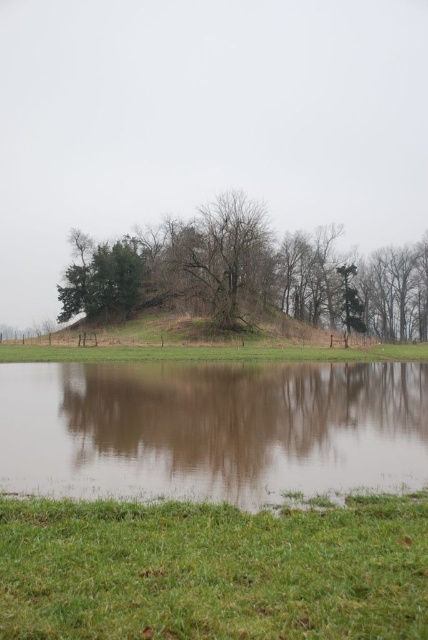
Who is positioned more to the right, green leafy tree at center or green grassy field at center?

green leafy tree at center

Who is higher up, green leafy tree at center or green grassy field at center?

green leafy tree at center is higher up.

Find the location of a particular element. green leafy tree at center is located at coordinates (247, 275).

Is green leafy tree at center smaller than green matte tree at upper left?

No, green leafy tree at center is not smaller than green matte tree at upper left.

Is green leafy tree at center thinner than green matte tree at upper left?

No.

Locate an element on the screen. The height and width of the screenshot is (640, 428). green leafy tree at center is located at coordinates (247, 275).

Can you confirm if green grassy at lower center is wider than green grassy field at center?

Incorrect, green grassy at lower center's width does not surpass green grassy field at center's.

Is point (2, 547) closer to camera compared to point (404, 342)?

Yes, point (2, 547) is in front of point (404, 342).

Is point (140, 605) farther from camera compared to point (177, 356)?

No.

Where is `green grassy at lower center`? This screenshot has width=428, height=640. green grassy at lower center is located at coordinates (214, 570).